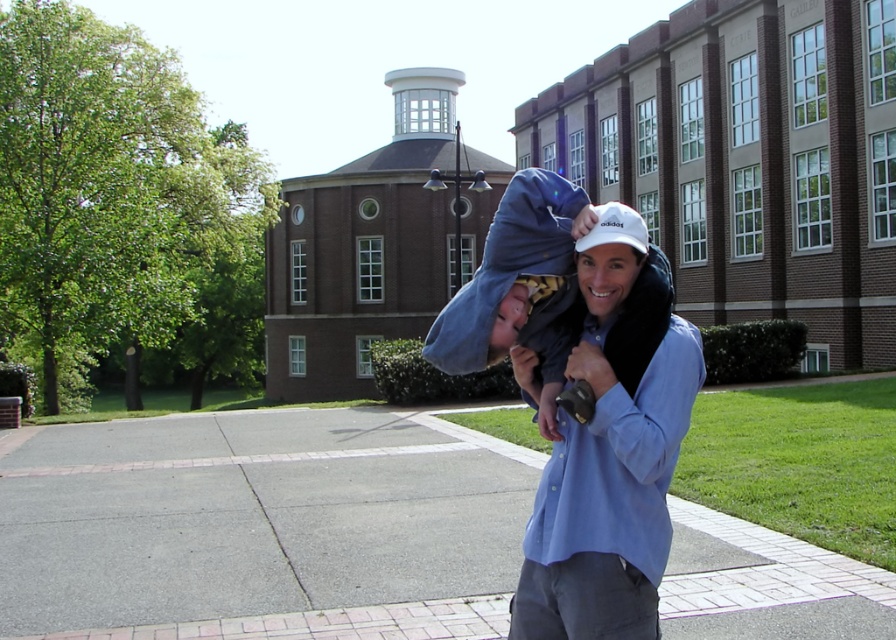
You are a photographer trying to capture the man and child in the scene. The man is wearing a light blue button up shirt and gray pants. The child is wearing a dark blue jacket and a white cap with the Adidas logo. You want to focus on the point at coordinates point (610,454). Based on the scene description, where is this point located?

The point (610,454) is on the blue cotton shirt at center.

You are a photographer trying to capture the man and child in the scene. You want to ensure both the blue cotton shirt at center and the blue fleece hat at center are clearly visible. Which object should you focus on to ensure the larger one is sharp?

The blue cotton shirt at center is bigger than the blue fleece hat at center, so you should focus on the blue cotton shirt at center to ensure the larger object is sharp.

You are a photographer trying to capture the perfect shot of the man and child in the scene. You need to ensure that both the blue cotton shirt at center and the blue fleece hat at center are in focus. Given that your camera can only focus on objects within a 20 cm range of each other, will you be able to achieve this?

The blue cotton shirt at center is 25.84 centimeters from the blue fleece hat at center. Since the distance exceeds the camera focus range of 20 cm, the camera cannot keep both in focus simultaneously.